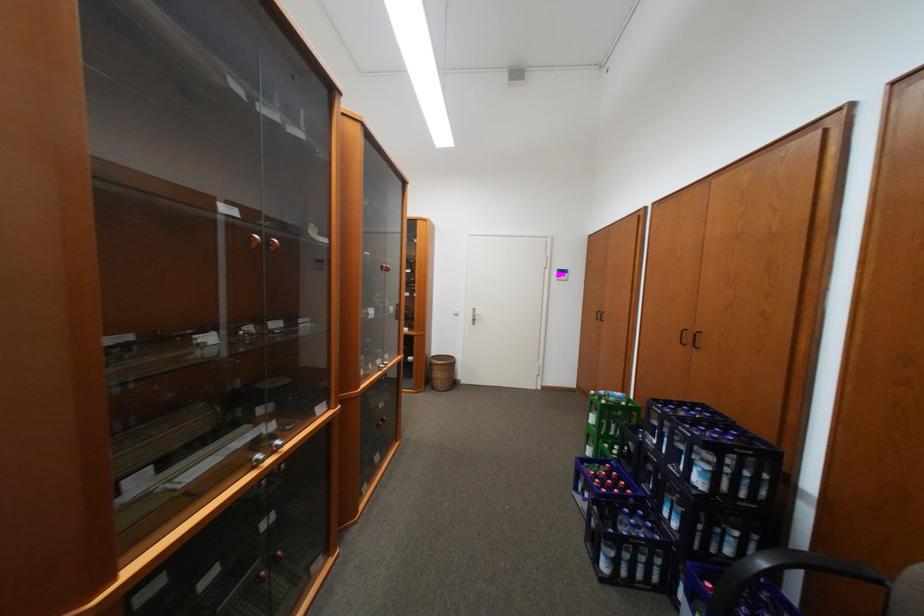
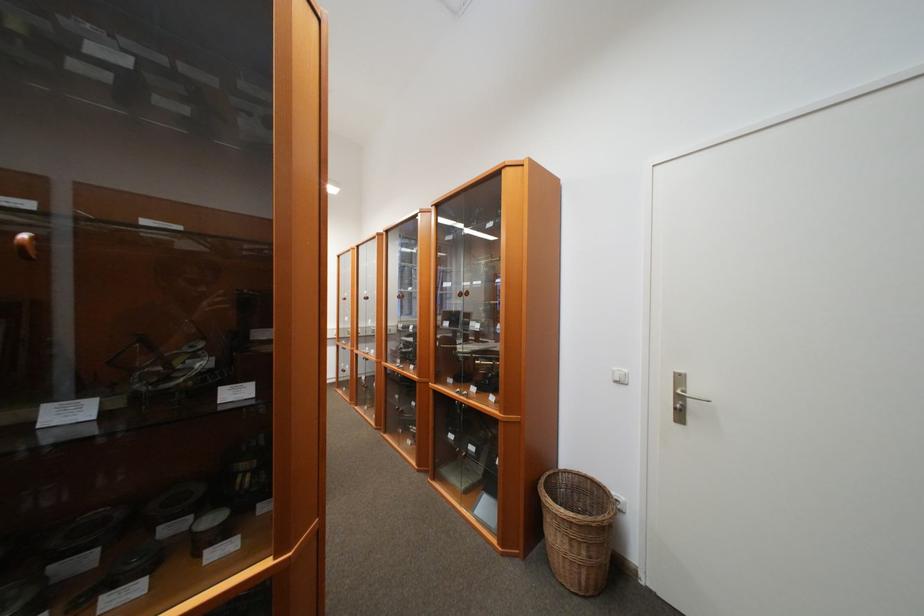
Where in the second image is the point corresponding to [483,315] from the first image?

(689, 399)